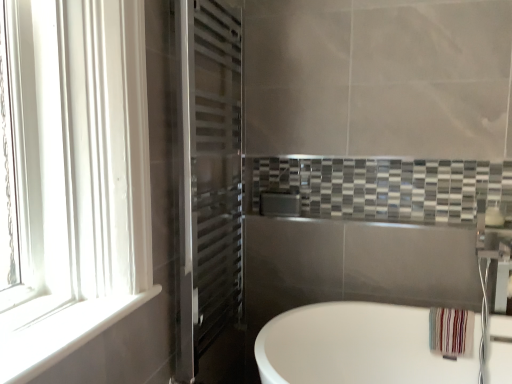
What is the approximate width of polished stainless steel towel rack at left?

The width of polished stainless steel towel rack at left is 3.27 inches.

What do you see at coordinates (216, 189) in the screenshot?
I see `polished stainless steel towel rack at left` at bounding box center [216, 189].

Locate an element on the screen. white glossy bathtub at lower right is located at coordinates (357, 346).

This screenshot has width=512, height=384. What do you see at coordinates (357, 346) in the screenshot?
I see `white glossy bathtub at lower right` at bounding box center [357, 346].

You are a GUI agent. You are given a task and a screenshot of the screen. Output one action in this format:
    pyautogui.click(x=<x>, y=<y>)
    Task: Click on the polished stainless steel towel rack at left
    
    Given the screenshot: What is the action you would take?
    pyautogui.click(x=216, y=189)

Does point (465, 335) appear closer or farther from the camera than point (209, 53)?

Clearly, point (465, 335) is more distant from the camera than point (209, 53).

In the scene shown: Does striped fabric towel at lower right contain polished stainless steel towel rack at left?

No, polished stainless steel towel rack at left is not surrounded by striped fabric towel at lower right.

From their relative heights in the image, would you say striped fabric towel at lower right is taller or shorter than polished stainless steel towel rack at left?

In the image, striped fabric towel at lower right appears to be shorter than polished stainless steel towel rack at left.

Between striped fabric towel at lower right and white smooth window sill at left, which one appears on the right side from the viewer's perspective?

From the viewer's perspective, striped fabric towel at lower right appears more on the right side.

Could you tell me if striped fabric towel at lower right is turned towards white smooth window sill at left?

No, striped fabric towel at lower right is not aimed at white smooth window sill at left.

Is striped fabric towel at lower right next to white smooth window sill at left?

No, striped fabric towel at lower right is not in contact with white smooth window sill at left.

Can you confirm if striped fabric towel at lower right is thinner than white smooth window sill at left?

Yes, striped fabric towel at lower right is thinner than white smooth window sill at left.

Consider the image. From a real-world perspective, does polished stainless steel towel rack at left stand above white glossy bathtub at lower right?

Yes.

Considering the sizes of objects polished stainless steel towel rack at left and white glossy bathtub at lower right in the image provided, who is bigger, polished stainless steel towel rack at left or white glossy bathtub at lower right?

white glossy bathtub at lower right.

Consider the image. Which is more to the right, polished stainless steel towel rack at left or white glossy bathtub at lower right?

white glossy bathtub at lower right.

Is white glossy bathtub at lower right far from striped fabric towel at lower right?

No, white glossy bathtub at lower right is not far from striped fabric towel at lower right.

Which object is further away from the camera taking this photo, white glossy bathtub at lower right or striped fabric towel at lower right?

striped fabric towel at lower right.

From the picture: From a real-world perspective, relative to striped fabric towel at lower right, is white glossy bathtub at lower right vertically above or below?

Clearly, from a real-world perspective, white glossy bathtub at lower right is below striped fabric towel at lower right.

Identify the location of material behind the white smooth window sill at left. (451, 332).

Is point (88, 308) positioned in front of point (455, 311)?

Yes, point (88, 308) is in front of point (455, 311).

Measure the distance between white smooth window sill at left and striped fabric towel at lower right.

white smooth window sill at left is 1.27 meters away from striped fabric towel at lower right.

Does point (443, 328) appear closer or farther from the camera than point (511, 332)?

Point (443, 328) is positioned farther from the camera compared to point (511, 332).

From the picture: Would you consider striped fabric towel at lower right to be distant from white glossy bathtub at lower right?

No, striped fabric towel at lower right is not far from white glossy bathtub at lower right.

From the picture: From a real-world perspective, is striped fabric towel at lower right positioned under white glossy bathtub at lower right based on gravity?

No, from a real-world perspective, striped fabric towel at lower right is not under white glossy bathtub at lower right.

Visually, is striped fabric towel at lower right positioned to the left or to the right of white glossy bathtub at lower right?

striped fabric towel at lower right is positioned on white glossy bathtub at lower right's right side.

Is white smooth window sill at left not near white glossy bathtub at lower right?

No, there isn't a large distance between white smooth window sill at left and white glossy bathtub at lower right.

Is white smooth window sill at left located outside white glossy bathtub at lower right?

Indeed, white smooth window sill at left is completely outside white glossy bathtub at lower right.

Which is nearer, (48,351) or (327,375)?

Point (48,351) appears to be closer to the viewer than point (327,375).

Does white smooth window sill at left come behind white glossy bathtub at lower right?

No.

The height and width of the screenshot is (384, 512). I want to click on screen door above the striped fabric towel at lower right (from the image's perspective), so click(x=216, y=189).

This screenshot has width=512, height=384. Find the location of `material behind the white smooth window sill at left`. material behind the white smooth window sill at left is located at coordinates (451, 332).

Estimate the real-world distances between objects in this image. Which object is closer to white smooth window sill at left, polished stainless steel towel rack at left or striped fabric towel at lower right?

Based on the image, polished stainless steel towel rack at left appears to be nearer to white smooth window sill at left.

Looking at the image, which one is located further to striped fabric towel at lower right, white smooth window sill at left or polished stainless steel towel rack at left?

white smooth window sill at left lies further to striped fabric towel at lower right than the other object.

When comparing their distances from white smooth window sill at left, does white glossy bathtub at lower right or striped fabric towel at lower right seem further?

The object further to white smooth window sill at left is striped fabric towel at lower right.

Looking at the image, which one is located further to striped fabric towel at lower right, polished stainless steel towel rack at left or white smooth window sill at left?

Among the two, white smooth window sill at left is located further to striped fabric towel at lower right.

Looking at the image, which one is located closer to polished stainless steel towel rack at left, white smooth window sill at left or white glossy bathtub at lower right?

white glossy bathtub at lower right lies closer to polished stainless steel towel rack at left than the other object.

Looking at the image, which one is located further to white glossy bathtub at lower right, striped fabric towel at lower right or white smooth window sill at left?

white smooth window sill at left lies further to white glossy bathtub at lower right than the other object.

Considering their positions, is polished stainless steel towel rack at left positioned closer to white glossy bathtub at lower right than white smooth window sill at left?

Based on the image, polished stainless steel towel rack at left appears to be nearer to white glossy bathtub at lower right.

Considering their positions, is striped fabric towel at lower right positioned closer to polished stainless steel towel rack at left than white glossy bathtub at lower right?

white glossy bathtub at lower right.

Image resolution: width=512 pixels, height=384 pixels. What are the coordinates of `screen door between white smooth window sill at left and white glossy bathtub at lower right` in the screenshot? It's located at (216, 189).

Where is `bathtub between white smooth window sill at left and striped fabric towel at lower right`? This screenshot has height=384, width=512. bathtub between white smooth window sill at left and striped fabric towel at lower right is located at coordinates (357, 346).

Locate an element on the screen. bathtub located between polished stainless steel towel rack at left and striped fabric towel at lower right in the left-right direction is located at coordinates (357, 346).

I want to click on screen door between white smooth window sill at left and striped fabric towel at lower right in the horizontal direction, so click(x=216, y=189).